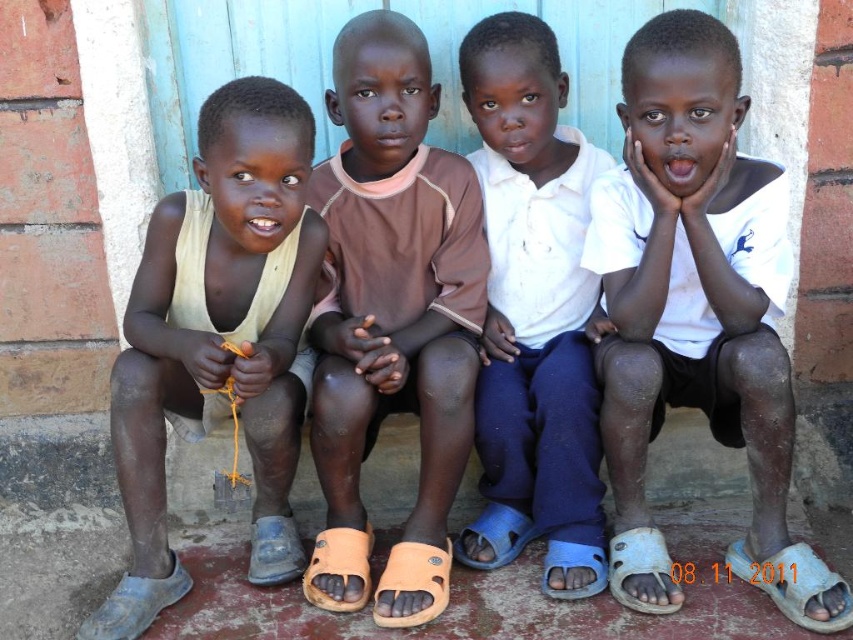
You are a photographer setting up a tripod to take a group photo of the boys. You need to ensure that the blue rubber sandal at lower right and the gray fabric sandal at lower left are both visible in the frame. Based on their positions, which sandal should you position closer to the center of the frame to include both in the shot without moving the boys?

To include both the blue rubber sandal at lower right and the gray fabric sandal at lower left in the frame, you should position the blue rubber sandal at lower right closer to the center since it is wider than the gray fabric sandal at lower left and might require more space to be fully visible.

You are a photographer setting up a shoot in the scene described. You need to place a small prop exactly halfway between the blue rubber sandal at lower right and the gray fabric sandal at lower left. Based on their positions, where should you place the prop?

The blue rubber sandal at lower right is to the right of the gray fabric sandal at lower left. Therefore, placing the prop halfway between them would require positioning it midway along the horizontal line connecting their positions, equidistant from both sandals.